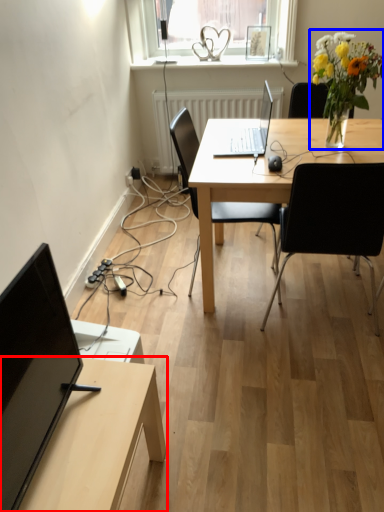
Question: Which object is closer to the camera taking this photo, table (highlighted by a red box) or floral arrangement (highlighted by a blue box)?

Choices:
 (A) table
 (B) floral arrangement

Answer: (A)